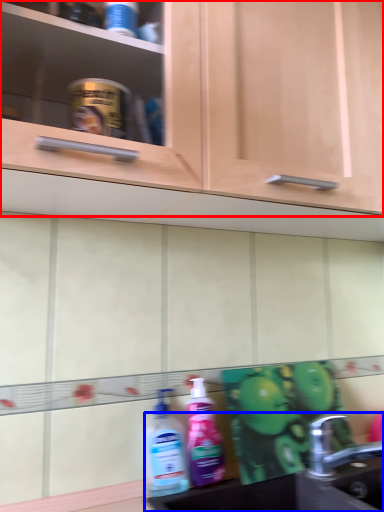
Question: Which point is further to the camera, cabinetry (highlighted by a red box) or sink (highlighted by a blue box)?

Choices:
 (A) cabinetry
 (B) sink

Answer: (B)